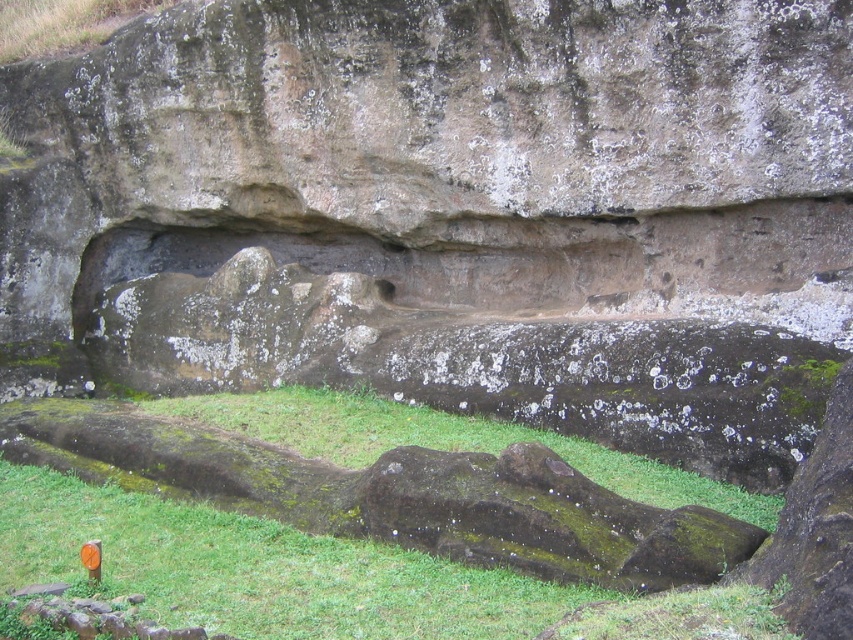
Is green mossy grass at lower center above green mossy grass at center?

No, green mossy grass at lower center is not above green mossy grass at center.

Is green mossy grass at lower center taller than green mossy grass at center?

No, green mossy grass at lower center is not taller than green mossy grass at center.

Image resolution: width=853 pixels, height=640 pixels. I want to click on green mossy grass at lower center, so [318, 576].